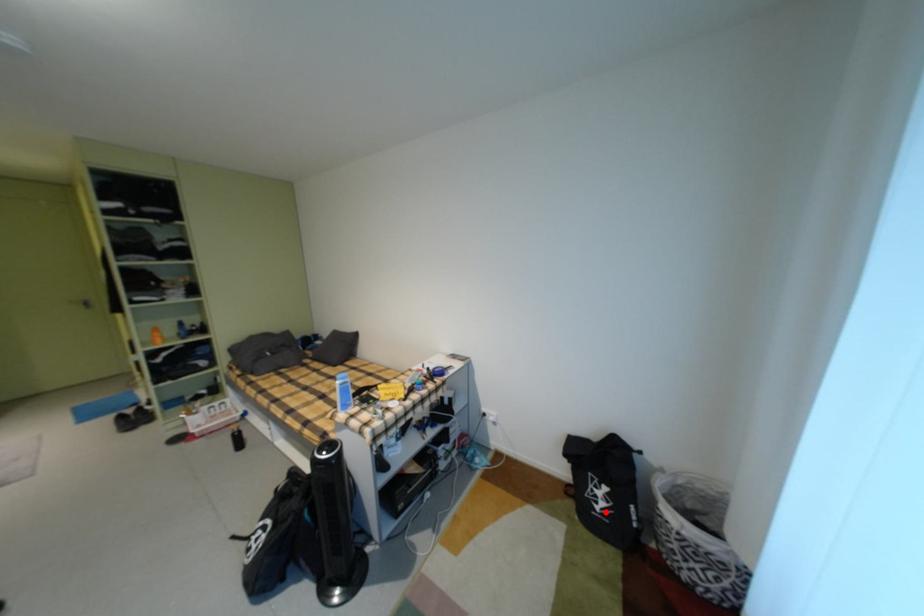
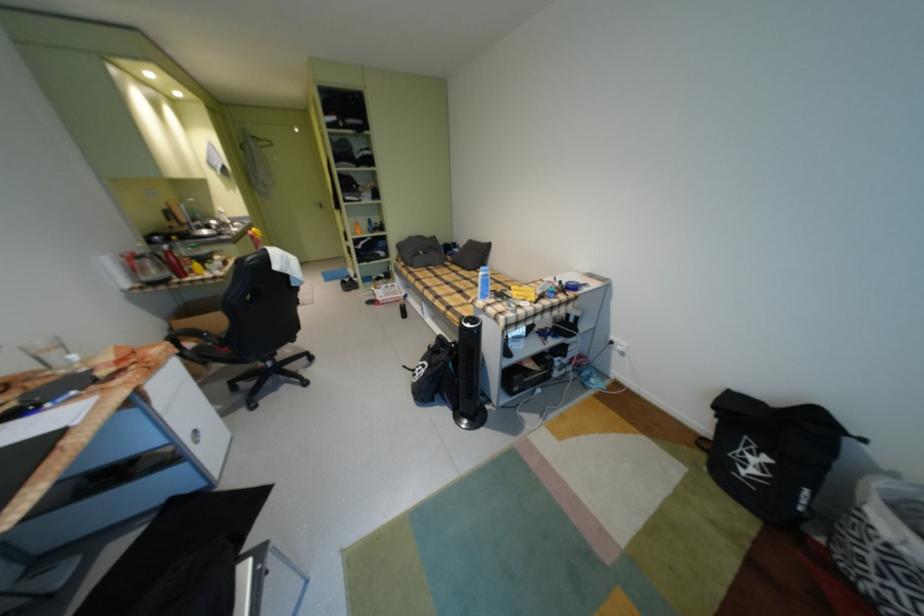
The point at the highlighted location is marked in the first image. Where is the corresponding point in the second image?

(748, 474)